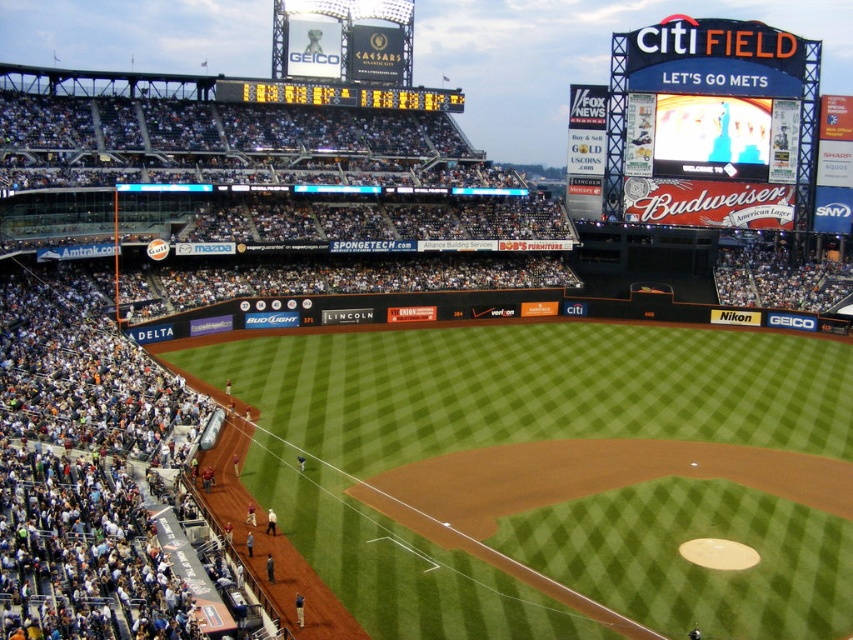
Question: Which point is closer to the camera?

Choices:
 (A) (782, 448)
 (B) (621, 205)

Answer: (A)

Question: Among these points, which one is farthest from the camera?

Choices:
 (A) (708, 508)
 (B) (250, 99)

Answer: (B)

Question: Can you confirm if blue plastic scoreboard at upper right is positioned to the left of yellow digital scoreboard at upper center?

Choices:
 (A) yes
 (B) no

Answer: (B)

Question: Based on their relative distances, which object is farther from the blue plastic scoreboard at upper right?

Choices:
 (A) yellow digital scoreboard at upper center
 (B) green grass baseball field at lower left

Answer: (B)

Question: Is green grass baseball field at lower left above yellow digital scoreboard at upper center?

Choices:
 (A) yes
 (B) no

Answer: (B)

Question: Can you confirm if green grass baseball field at lower left is positioned above blue plastic scoreboard at upper right?

Choices:
 (A) yes
 (B) no

Answer: (B)